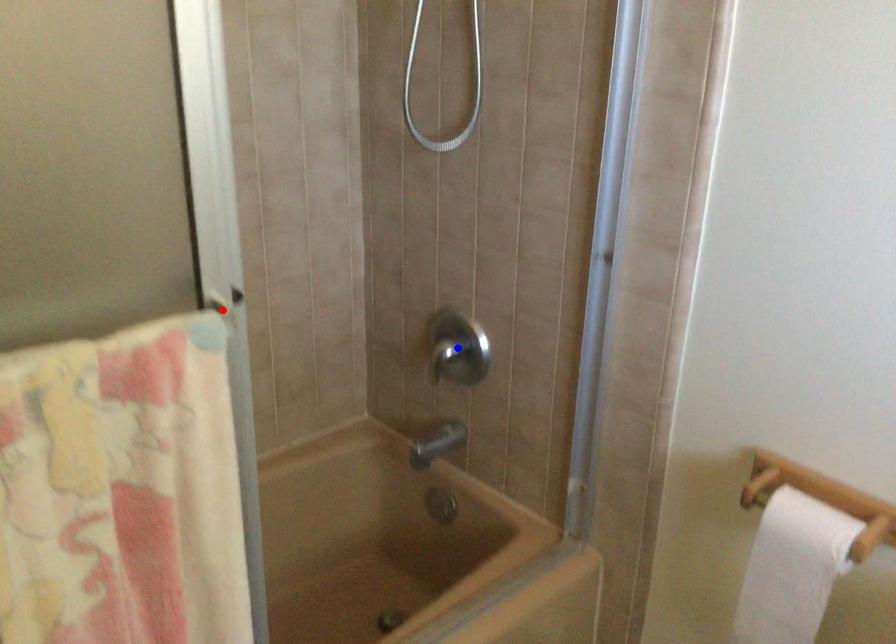
Question: Which of the two points in the image is closer to the camera?

Choices:
 (A) Blue point is closer.
 (B) Red point is closer.

Answer: (B)